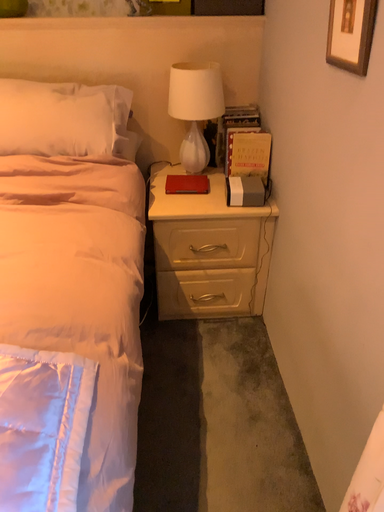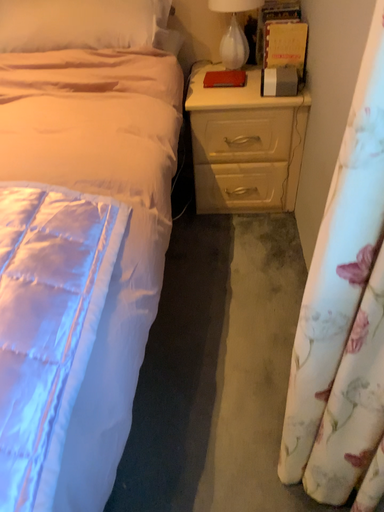
Question: Which way did the camera rotate in the video?

Choices:
 (A) rotated upward
 (B) rotated downward

Answer: (B)